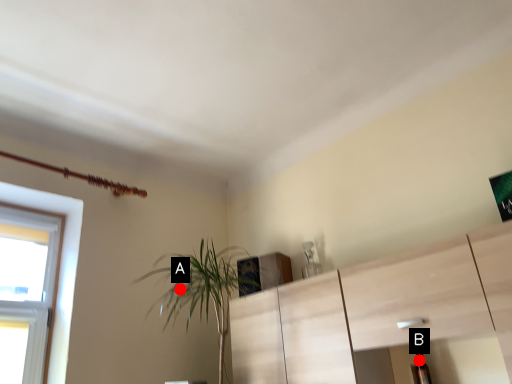
Question: Two points are circled on the image, labeled by A and B beside each circle. Which point is farther to the camera?

Choices:
 (A) A is further
 (B) B is further

Answer: (A)